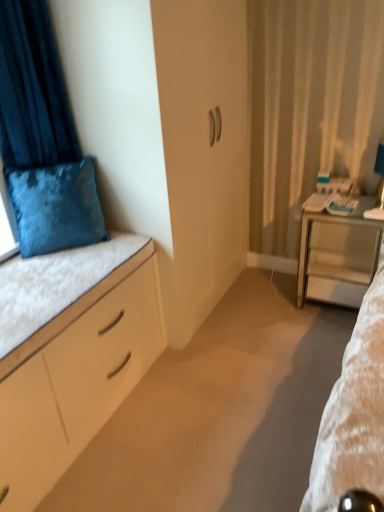
Question: Considering the relative sizes of metallic silver desk at right and velvet blue cushion at upper left in the image provided, is metallic silver desk at right wider than velvet blue cushion at upper left?

Choices:
 (A) no
 (B) yes

Answer: (B)

Question: Is metallic silver desk at right far from velvet blue cushion at upper left?

Choices:
 (A) no
 (B) yes

Answer: (B)

Question: Can you confirm if metallic silver desk at right is taller than velvet blue cushion at upper left?

Choices:
 (A) no
 (B) yes

Answer: (A)

Question: Can velvet blue cushion at upper left be found inside metallic silver desk at right?

Choices:
 (A) no
 (B) yes

Answer: (A)

Question: Is metallic silver desk at right further to camera compared to velvet blue cushion at upper left?

Choices:
 (A) no
 (B) yes

Answer: (B)

Question: Considering the positions of point (352, 239) and point (142, 237), is point (352, 239) closer or farther from the camera than point (142, 237)?

Choices:
 (A) closer
 (B) farther

Answer: (B)

Question: From the image's perspective, is metallic silver desk at right located above or below white matte cushion at left?

Choices:
 (A) above
 (B) below

Answer: (A)

Question: Based on their sizes in the image, would you say metallic silver desk at right is bigger or smaller than white matte cushion at left?

Choices:
 (A) small
 (B) big

Answer: (B)

Question: In terms of width, does metallic silver desk at right look wider or thinner when compared to white matte cushion at left?

Choices:
 (A) wide
 (B) thin

Answer: (B)

Question: Based on their sizes in the image, would you say matte white table lamp at right is bigger or smaller than velvet blue pillow at upper left?

Choices:
 (A) small
 (B) big

Answer: (A)

Question: Does point (382, 153) appear closer or farther from the camera than point (46, 201)?

Choices:
 (A) farther
 (B) closer

Answer: (A)

Question: In terms of width, does matte white table lamp at right look wider or thinner when compared to velvet blue pillow at upper left?

Choices:
 (A) thin
 (B) wide

Answer: (A)

Question: In the image, is matte white table lamp at right on the left side or the right side of velvet blue pillow at upper left?

Choices:
 (A) left
 (B) right

Answer: (B)

Question: In terms of height, does metallic silver desk at right look taller or shorter compared to matte white table lamp at right?

Choices:
 (A) short
 (B) tall

Answer: (B)

Question: From the image's perspective, is metallic silver desk at right located above or below matte white table lamp at right?

Choices:
 (A) above
 (B) below

Answer: (B)